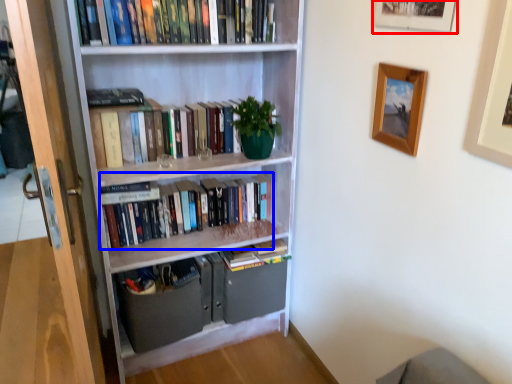
Question: Which object is further to the camera taking this photo, picture frame (highlighted by a red box) or book (highlighted by a blue box)?

Choices:
 (A) picture frame
 (B) book

Answer: (B)